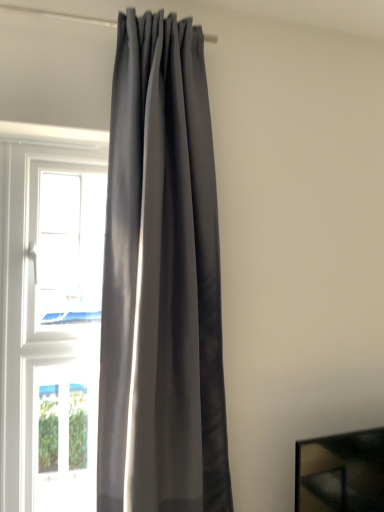
Question: Does white glossy window at left, the second window ordered from the bottom, have a lesser height compared to transparent glass window at left, arranged as the 2th window when viewed from the top?

Choices:
 (A) no
 (B) yes

Answer: (A)

Question: Is white glossy window at left, which ranks as the first window in top-to-bottom order, turned away from transparent glass window at left, arranged as the 2th window when viewed from the top?

Choices:
 (A) no
 (B) yes

Answer: (A)

Question: From the image's perspective, is white glossy window at left, which ranks as the first window in top-to-bottom order, over transparent glass window at left, arranged as the 2th window when viewed from the top?

Choices:
 (A) no
 (B) yes

Answer: (B)

Question: Can you confirm if white glossy window at left, the second window ordered from the bottom, is taller than transparent glass window at left, marked as the 1th window in a bottom-to-top arrangement?

Choices:
 (A) no
 (B) yes

Answer: (B)

Question: Is white glossy window at left, the second window ordered from the bottom, to the right of transparent glass window at left, marked as the 1th window in a bottom-to-top arrangement, from the viewer's perspective?

Choices:
 (A) yes
 (B) no

Answer: (A)

Question: In terms of size, does white glossy window at left, which ranks as the first window in top-to-bottom order, appear bigger or smaller than transparent glass window at left, marked as the 1th window in a bottom-to-top arrangement?

Choices:
 (A) big
 (B) small

Answer: (A)

Question: Is point (44, 315) positioned closer to the camera than point (57, 503)?

Choices:
 (A) farther
 (B) closer

Answer: (B)

Question: From the image's perspective, relative to transparent glass window at left, marked as the 1th window in a bottom-to-top arrangement, is white glossy window at left, which ranks as the first window in top-to-bottom order, above or below?

Choices:
 (A) above
 (B) below

Answer: (A)

Question: Is white glossy window at left, which ranks as the first window in top-to-bottom order, wider or thinner than transparent glass window at left, marked as the 1th window in a bottom-to-top arrangement?

Choices:
 (A) wide
 (B) thin

Answer: (A)

Question: From the image's perspective, relative to white glossy window at left, which ranks as the first window in top-to-bottom order, is matte gray curtain at center above or below?

Choices:
 (A) below
 (B) above

Answer: (A)

Question: Is matte gray curtain at center inside or outside of white glossy window at left, the second window ordered from the bottom?

Choices:
 (A) inside
 (B) outside

Answer: (B)

Question: Is matte gray curtain at center to the left or to the right of white glossy window at left, the second window ordered from the bottom, in the image?

Choices:
 (A) right
 (B) left

Answer: (A)

Question: Is matte gray curtain at center wider or thinner than white glossy window at left, the second window ordered from the bottom?

Choices:
 (A) thin
 (B) wide

Answer: (B)

Question: From a real-world perspective, relative to matte gray curtain at center, is white glossy window at left, which ranks as the first window in top-to-bottom order, vertically above or below?

Choices:
 (A) above
 (B) below

Answer: (A)

Question: Is white glossy window at left, the second window ordered from the bottom, inside or outside of matte gray curtain at center?

Choices:
 (A) inside
 (B) outside

Answer: (B)